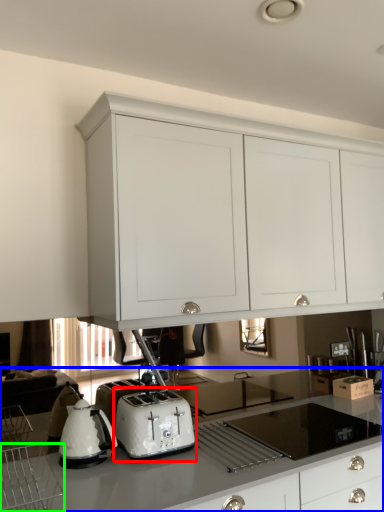
Question: Considering the real-world distances, which object is farthest from toaster (highlighted by a red box)? countertop (highlighted by a blue box) or kitchen appliance (highlighted by a green box)?

Choices:
 (A) countertop
 (B) kitchen appliance

Answer: (B)